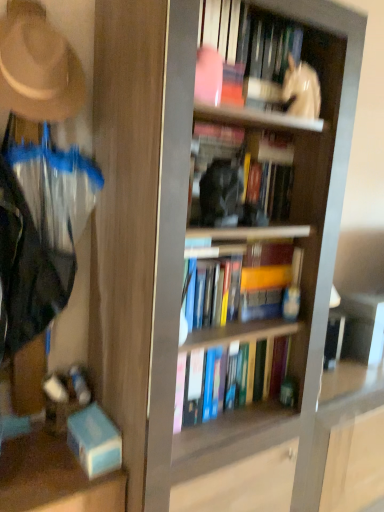
Question: Does white glossy statue at upper center come in front of hardcover books at center, arranged as the 4th book when viewed from the top?

Choices:
 (A) yes
 (B) no

Answer: (A)

Question: From a real-world perspective, is white glossy statue at upper center located higher than hardcover books at center, the first book when ordered from bottom to top?

Choices:
 (A) no
 (B) yes

Answer: (B)

Question: Does white glossy statue at upper center have a smaller size compared to hardcover books at center, arranged as the 4th book when viewed from the top?

Choices:
 (A) yes
 (B) no

Answer: (A)

Question: From the image's perspective, is white glossy statue at upper center located above hardcover books at center, arranged as the 4th book when viewed from the top?

Choices:
 (A) no
 (B) yes

Answer: (B)

Question: Is white glossy statue at upper center bigger than hardcover books at center, arranged as the 4th book when viewed from the top?

Choices:
 (A) no
 (B) yes

Answer: (A)

Question: From the image's perspective, is hardcover book at center, arranged as the 2th book when viewed from the top, positioned above or below white glossy statue at upper center?

Choices:
 (A) below
 (B) above

Answer: (A)

Question: Looking at the image, does hardcover book at center, arranged as the 2th book when viewed from the top, seem bigger or smaller compared to white glossy statue at upper center?

Choices:
 (A) big
 (B) small

Answer: (A)

Question: Do you think hardcover book at center, arranged as the 2th book when viewed from the top, is within white glossy statue at upper center, or outside of it?

Choices:
 (A) inside
 (B) outside

Answer: (B)

Question: Considering their positions, is hardcover book at center, the third book when ordered from bottom to top, located in front of or behind white glossy statue at upper center?

Choices:
 (A) behind
 (B) front

Answer: (A)

Question: Is hardcover book at center, arranged as the 2th book when viewed from the top, bigger or smaller than white glossy statue at upper center, which ranks as the first book in top-to-bottom order?

Choices:
 (A) big
 (B) small

Answer: (B)

Question: Is hardcover book at center, the third book when ordered from bottom to top, in front of or behind white glossy statue at upper center, which ranks as the first book in top-to-bottom order, in the image?

Choices:
 (A) front
 (B) behind

Answer: (B)

Question: Is hardcover book at center, the third book when ordered from bottom to top, situated inside white glossy statue at upper center, which ranks as the 4th book in bottom-to-top order, or outside?

Choices:
 (A) outside
 (B) inside

Answer: (A)

Question: From a real-world perspective, is hardcover book at center, the third book when ordered from bottom to top, positioned above or below white glossy statue at upper center, which ranks as the 4th book in bottom-to-top order?

Choices:
 (A) below
 (B) above

Answer: (A)

Question: Considering the positions of point (258, 163) and point (241, 264), is point (258, 163) closer or farther from the camera than point (241, 264)?

Choices:
 (A) farther
 (B) closer

Answer: (A)

Question: Is hardcover book at center, the third book when ordered from bottom to top, taller or shorter than hardcover books at center, the first book when ordered from bottom to top?

Choices:
 (A) short
 (B) tall

Answer: (A)